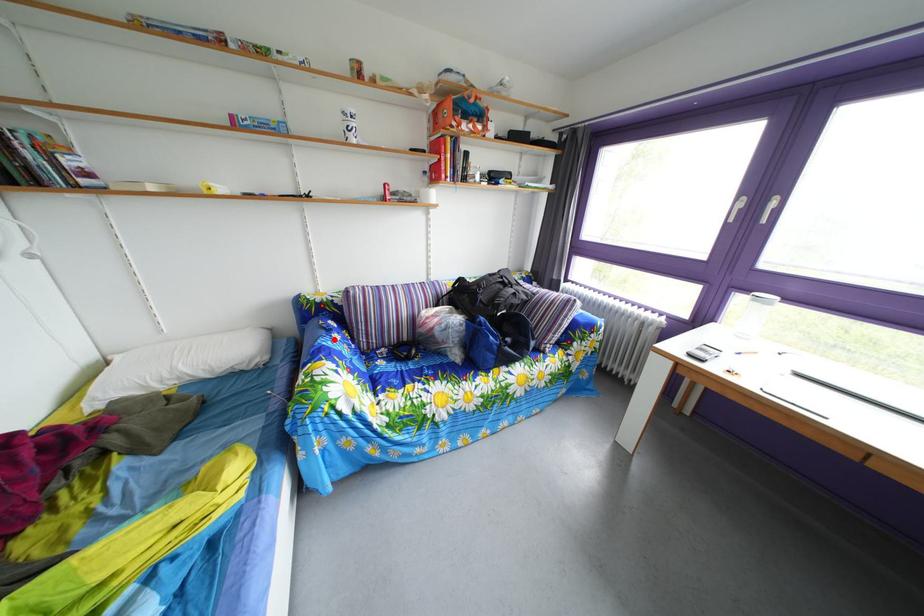
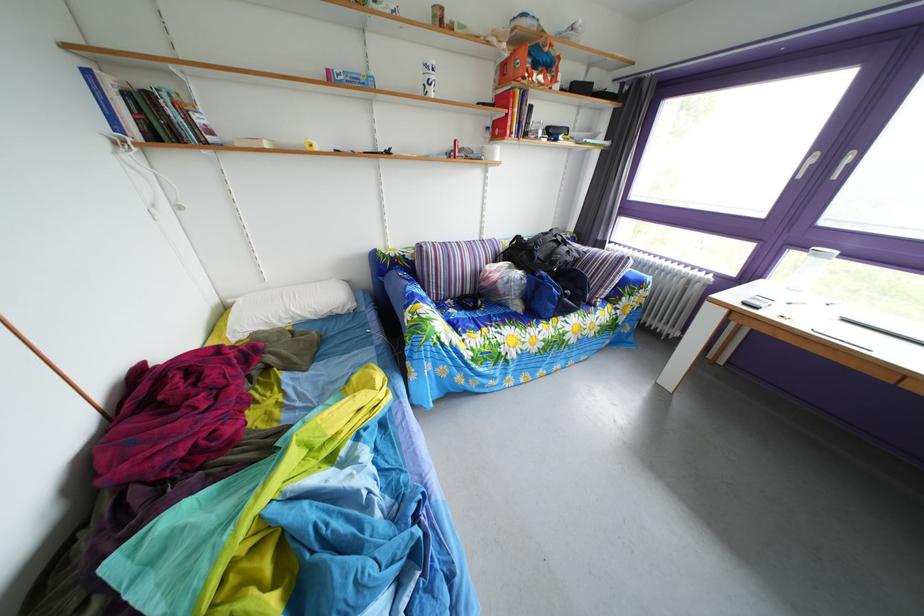
Locate, in the second image, the point that corresponds to the highlighted location in the first image.

(417, 290)